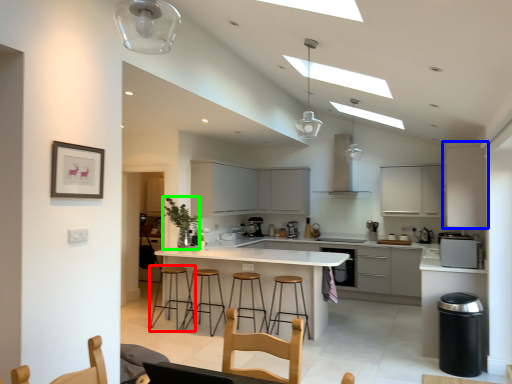
Question: Based on their relative distances, which object is farther from bar stool (highlighted by a red box)? Choose from cabinetry (highlighted by a blue box) and plant (highlighted by a green box).

Choices:
 (A) cabinetry
 (B) plant

Answer: (A)